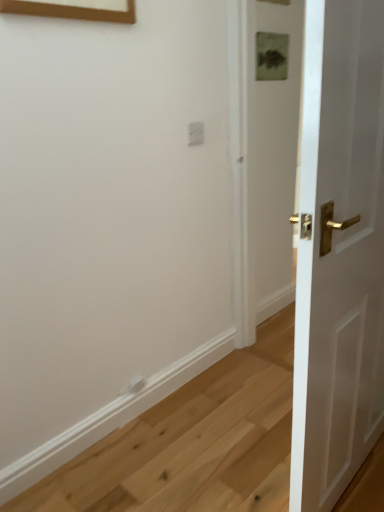
What do you see at coordinates (195, 133) in the screenshot? I see `white plastic electric outlet at upper center` at bounding box center [195, 133].

Locate an element on the screen. The width and height of the screenshot is (384, 512). white plastic electric outlet at upper center is located at coordinates (195, 133).

You are a GUI agent. You are given a task and a screenshot of the screen. Output one action in this format:
    pyautogui.click(x=<x>, y=<y>)
    Task: Click on the white glossy door at right
    
    Given the screenshot: What is the action you would take?
    pyautogui.click(x=339, y=252)

The width and height of the screenshot is (384, 512). Describe the element at coordinates (339, 252) in the screenshot. I see `white glossy door at right` at that location.

Identify the location of white plastic electric outlet at upper center. (195, 133).

Is white glossy door at right at the right side of white plastic electric outlet at upper center?

Yes, white glossy door at right is to the right of white plastic electric outlet at upper center.

Is white glossy door at right in front of white plastic electric outlet at upper center?

Yes, white glossy door at right is in front of white plastic electric outlet at upper center.

Considering the points (305, 320) and (193, 137), which point is in front, point (305, 320) or point (193, 137)?

The point (305, 320) is more forward.

From the image's perspective, does white glossy door at right appear lower than white plastic electric outlet at upper center?

Yes, from the image's perspective, white glossy door at right is below white plastic electric outlet at upper center.

From a real-world perspective, relative to white plastic electric outlet at upper center, is white glossy door at right vertically above or below?

Clearly, from a real-world perspective, white glossy door at right is below white plastic electric outlet at upper center.

Looking at their sizes, would you say white glossy door at right is wider or thinner than white plastic electric outlet at upper center?

Considering their sizes, white glossy door at right looks broader than white plastic electric outlet at upper center.

Who is taller, white glossy door at right or white plastic electric outlet at upper center?

white glossy door at right is taller.

Can you confirm if white glossy door at right is bigger than white plastic electric outlet at upper center?

Yes, white glossy door at right is bigger than white plastic electric outlet at upper center.

Is white glossy door at right not within white plastic electric outlet at upper center?

Result: Indeed, white glossy door at right is completely outside white plastic electric outlet at upper center.

Would you say white glossy door at right is a long distance from white plastic electric outlet at upper center?

Yes, white glossy door at right is far from white plastic electric outlet at upper center.

Is white glossy door at right oriented towards white plastic electric outlet at upper center?

Yes, white glossy door at right is facing white plastic electric outlet at upper center.

How many degrees apart are the facing directions of white glossy door at right and white plastic electric outlet at upper center?

white glossy door at right and white plastic electric outlet at upper center are facing 90.4 degrees away from each other.

Measure the distance between white glossy door at right and white plastic electric outlet at upper center.

white glossy door at right is 1.05 meters away from white plastic electric outlet at upper center.

Find the location of a particular element. Image resolution: width=384 pixels, height=512 pixels. door lying below the white plastic electric outlet at upper center (from the image's perspective) is located at coordinates point(339,252).

Which is more to the left, white plastic electric outlet at upper center or white glossy door at right?

From the viewer's perspective, white plastic electric outlet at upper center appears more on the left side.

Is white plastic electric outlet at upper center positioned behind white glossy door at right?

Yes, white plastic electric outlet at upper center is further from the viewer.

Considering the positions of point (201, 123) and point (360, 389), is point (201, 123) closer or farther from the camera than point (360, 389)?

Point (201, 123) appears to be farther away from the viewer than point (360, 389).

From the image's perspective, which one is positioned lower, white plastic electric outlet at upper center or white glossy door at right?

white glossy door at right appears lower in the image.

From a real-world perspective, is white plastic electric outlet at upper center on white glossy door at right?

Yes, from a real-world perspective, white plastic electric outlet at upper center is on top of white glossy door at right.

Does white plastic electric outlet at upper center have a lesser width compared to white glossy door at right?

Yes.

Who is shorter, white plastic electric outlet at upper center or white glossy door at right?

white plastic electric outlet at upper center.

Does white plastic electric outlet at upper center have a larger size compared to white glossy door at right?

No.

Is white plastic electric outlet at upper center not within white glossy door at right?

Indeed, white plastic electric outlet at upper center is completely outside white glossy door at right.

Is white plastic electric outlet at upper center next to white glossy door at right and touching it?

white plastic electric outlet at upper center and white glossy door at right are clearly separated.

Is white plastic electric outlet at upper center positioned with its back to white glossy door at right?

white plastic electric outlet at upper center does not have its back to white glossy door at right.

How distant is white plastic electric outlet at upper center from white glossy door at right?

1.05 meters.

Where is `electric outlet lying on the left of white glossy door at right`? This screenshot has height=512, width=384. electric outlet lying on the left of white glossy door at right is located at coordinates (195, 133).

At what (x,y) coordinates should I click in order to perform the action: click on electric outlet above the white glossy door at right (from a real-world perspective). Please return your answer as a coordinate pair (x, y). The image size is (384, 512). Looking at the image, I should click on (195, 133).

At what (x,y) coordinates should I click in order to perform the action: click on door that appears on the right of white plastic electric outlet at upper center. Please return your answer as a coordinate pair (x, y). This screenshot has width=384, height=512. Looking at the image, I should click on (339, 252).